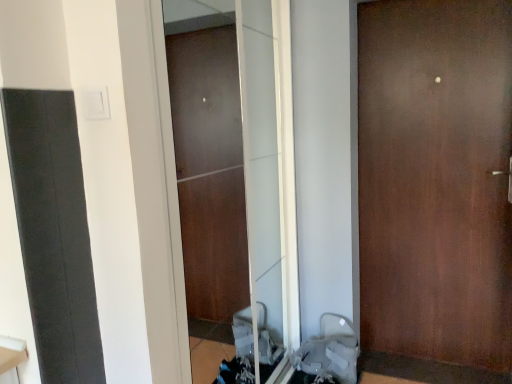
Question: Is brown matte door at center taller or shorter than gray fabric baby carriage at lower right?

Choices:
 (A) tall
 (B) short

Answer: (A)

Question: Is point (500, 329) closer or farther from the camera than point (326, 314)?

Choices:
 (A) closer
 (B) farther

Answer: (A)

Question: Estimate the real-world distances between objects in this image. Which object is farther from the transparent glass screen door at center?

Choices:
 (A) gray fabric baby carriage at lower right
 (B) brown matte door at center

Answer: (B)

Question: Based on their relative distances, which object is farther from the transparent glass screen door at center?

Choices:
 (A) gray fabric baby carriage at lower right
 (B) brown matte door at center

Answer: (B)